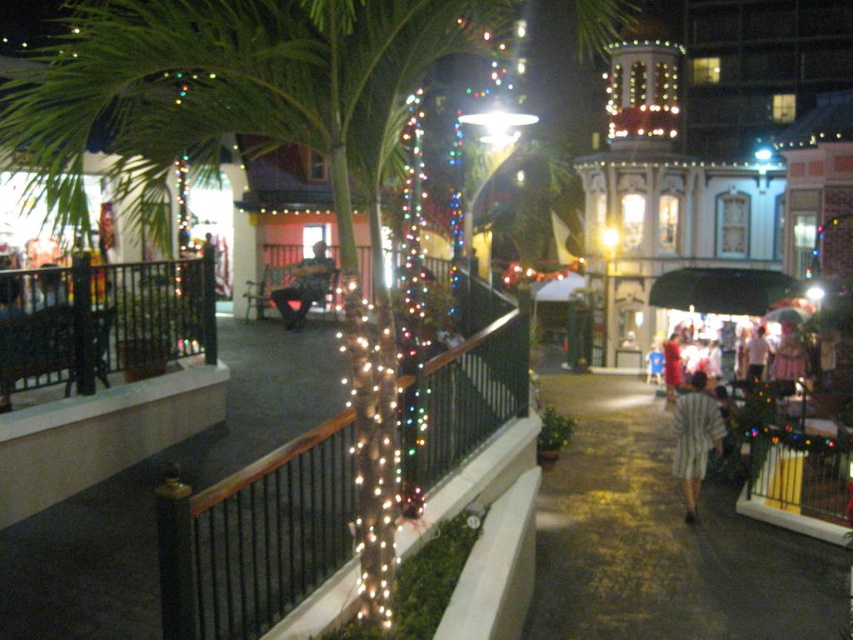
Does white glossy building at center appear on the left side of dark blue jeans at center?

Incorrect, white glossy building at center is not on the left side of dark blue jeans at center.

Does white glossy building at center have a greater height compared to dark blue jeans at center?

Yes, white glossy building at center is taller than dark blue jeans at center.

Is point (693, 100) in front of point (302, 305)?

That is False.

Where is `white glossy building at center`? white glossy building at center is located at coordinates (697, 145).

Can you confirm if dark asphalt pavement at lower center is wider than white cotton shirt at center?

Yes, dark asphalt pavement at lower center is wider than white cotton shirt at center.

Between dark asphalt pavement at lower center and white cotton shirt at center, which one appears on the left side from the viewer's perspective?

dark asphalt pavement at lower center is more to the left.

The image size is (853, 640). What do you see at coordinates (660, 538) in the screenshot?
I see `dark asphalt pavement at lower center` at bounding box center [660, 538].

Identify the location of dark asphalt pavement at lower center. The width and height of the screenshot is (853, 640). (660, 538).

Does illuminated wire mesh at upper center have a lesser height compared to white cotton shirt at center?

Yes.

Is point (279, 467) behind point (753, 364)?

No.

The width and height of the screenshot is (853, 640). Describe the element at coordinates (254, 536) in the screenshot. I see `illuminated wire mesh at upper center` at that location.

The height and width of the screenshot is (640, 853). What are the coordinates of `illuminated wire mesh at upper center` in the screenshot? It's located at (254, 536).